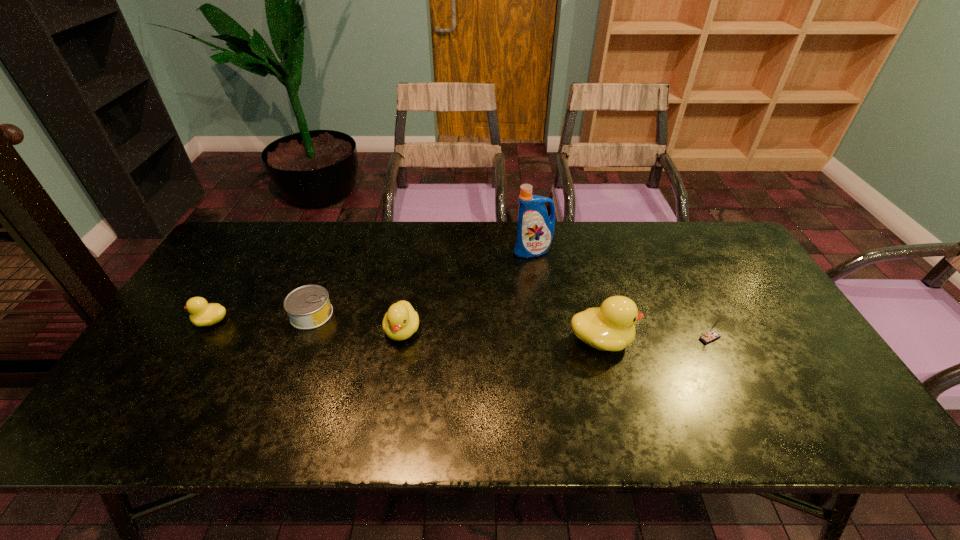
Locate an element on the screen. free space between the shortest object and the second shortest duckling is located at coordinates (357, 322).

Find the location of `free space between the farthest object and the leftmost object`. free space between the farthest object and the leftmost object is located at coordinates (372, 286).

The width and height of the screenshot is (960, 540). What are the coordinates of `unoccupied area between the matchbox and the leftmost duckling` in the screenshot? It's located at (461, 329).

Locate an element on the screen. This screenshot has width=960, height=540. vacant space that's between the tallest object and the second object from left to right is located at coordinates (422, 283).

Locate an element on the screen. object that can be found as the fourth closest to the fifth tallest object is located at coordinates (x=610, y=327).

Find the location of a particular element. The width and height of the screenshot is (960, 540). the fifth closest object to the leftmost object is located at coordinates (712, 334).

The height and width of the screenshot is (540, 960). Identify the location of duckling that is the closest to the rightmost duckling. (400, 322).

Locate an element on the screen. This screenshot has width=960, height=540. the second closest duckling to the second shortest duckling is located at coordinates (202, 313).

Identify the location of vacant region that satisfies the following two spatial constraints: 1. on the label of the farthest object; 2. on the beak of the fifth tallest object. (543, 321).

This screenshot has width=960, height=540. In order to click on vacant area that satisfies the following two spatial constraints: 1. on the beak of the second tallest duckling; 2. on the right side of the rightmost object in this screenshot , I will do `click(401, 338)`.